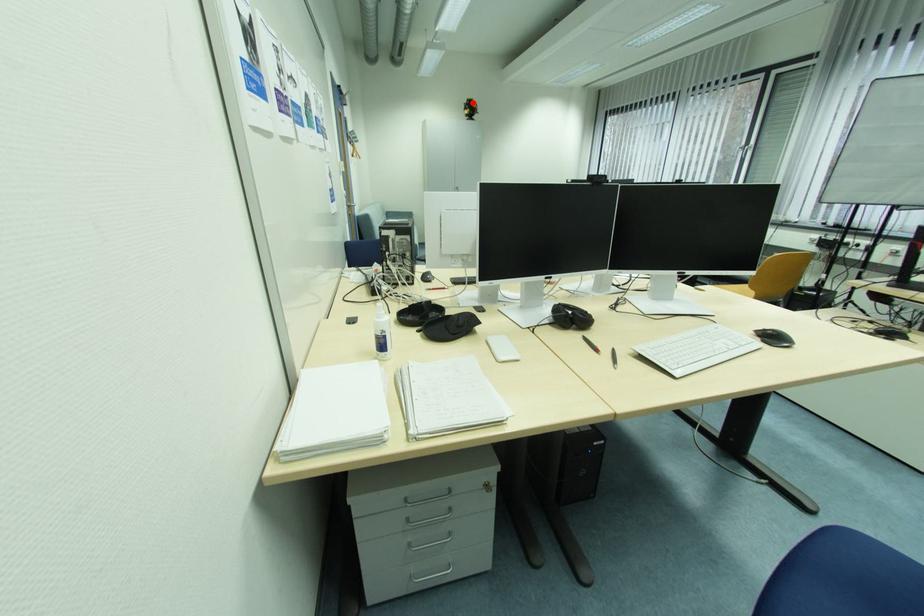
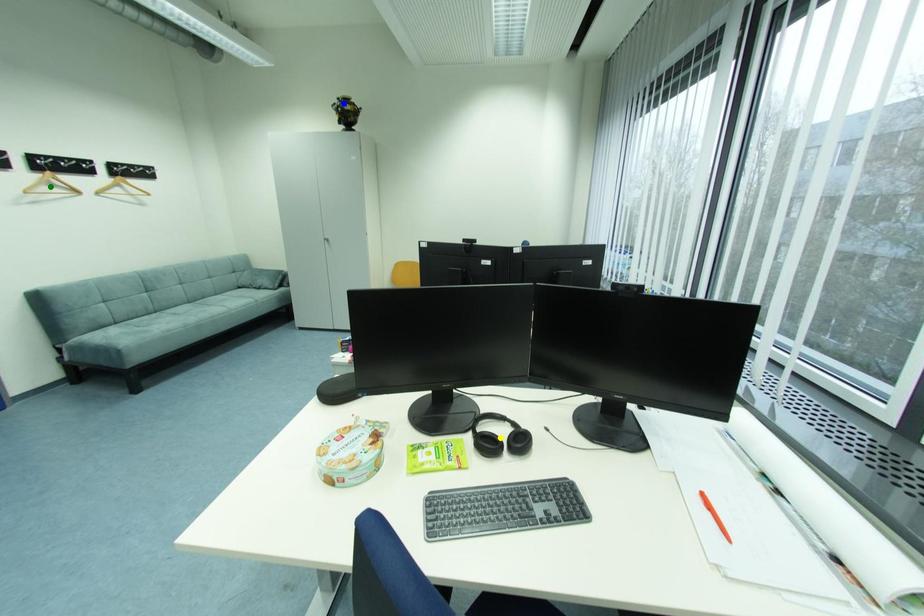
Question: I am providing you with two images of the same scene from different viewpoints. A red point is marked on the first image. You are given multiple points on the second image. Which point in image 2 is actually the same real-world point as the red point in image 1?

Choices:
 (A) yellow point
 (B) blue point
 (C) green point

Answer: (B)